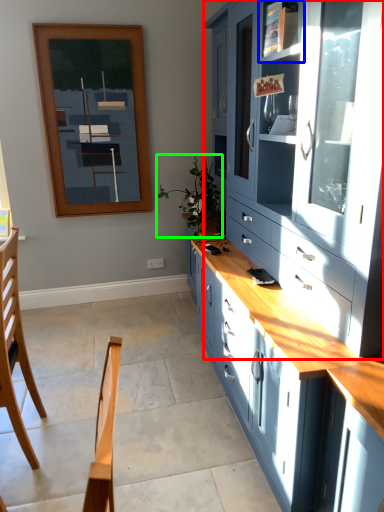
Question: Considering the real-world distances, which object is farthest from cabinetry (highlighted by a red box)? shelf (highlighted by a blue box) or plant (highlighted by a green box)?

Choices:
 (A) shelf
 (B) plant

Answer: (B)